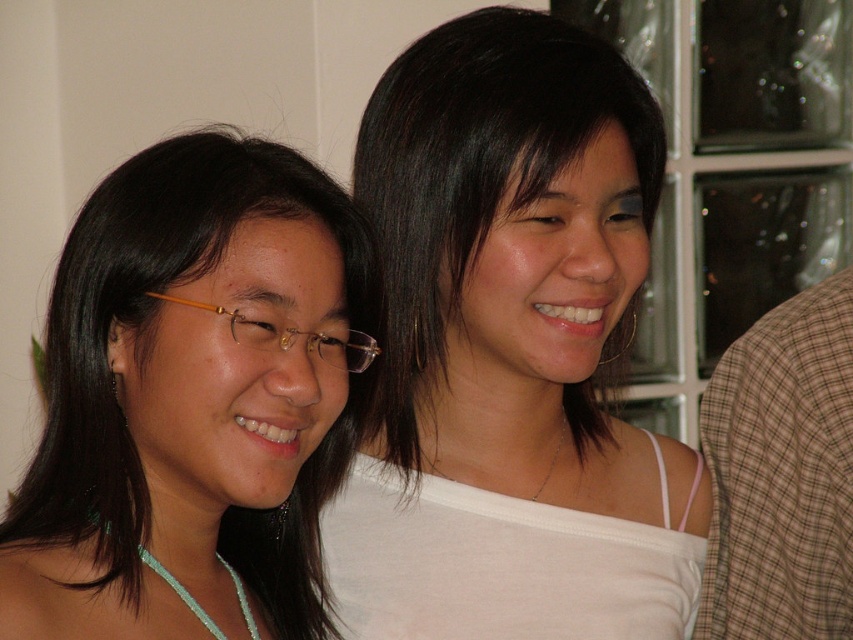
You are a photographer trying to focus on the matte gold glasses at left. What coordinates should you aim for?

You should aim for coordinates point (193, 401) to focus on the matte gold glasses at left.

You are a photographer setting up for a portrait. You need to ensure that the matte gold glasses at left and the brown plaid shirt at right are both in focus. Given that your camera has a depth of field that can cover objects within 20 inches of each other, will both items be in focus?

The matte gold glasses at left is 20.53 inches from the brown plaid shirt at right. Since the distance between them exceeds the camera sensor depth of field coverage of 20 inches, the two items might not both be in focus simultaneously.

Looking at this image, you are a photographer trying to capture a clear shot of both the matte gold glasses at left and the brown plaid shirt at right. Since you can only focus on one object at a time, which one should you focus on to ensure the other is also in focus?

You should focus on the matte gold glasses at left because it is in front of the brown plaid shirt at right, so focusing on the closer object will keep both in focus.